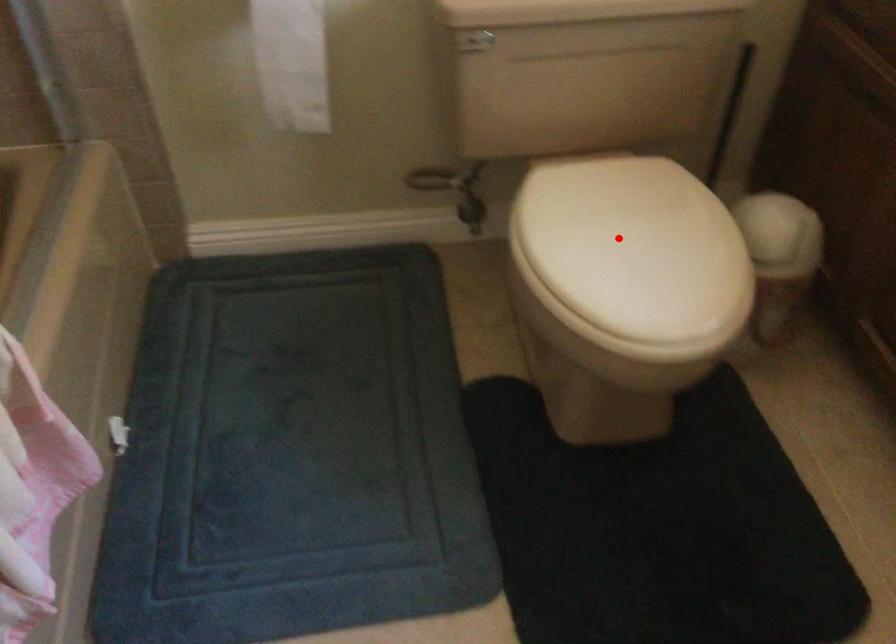
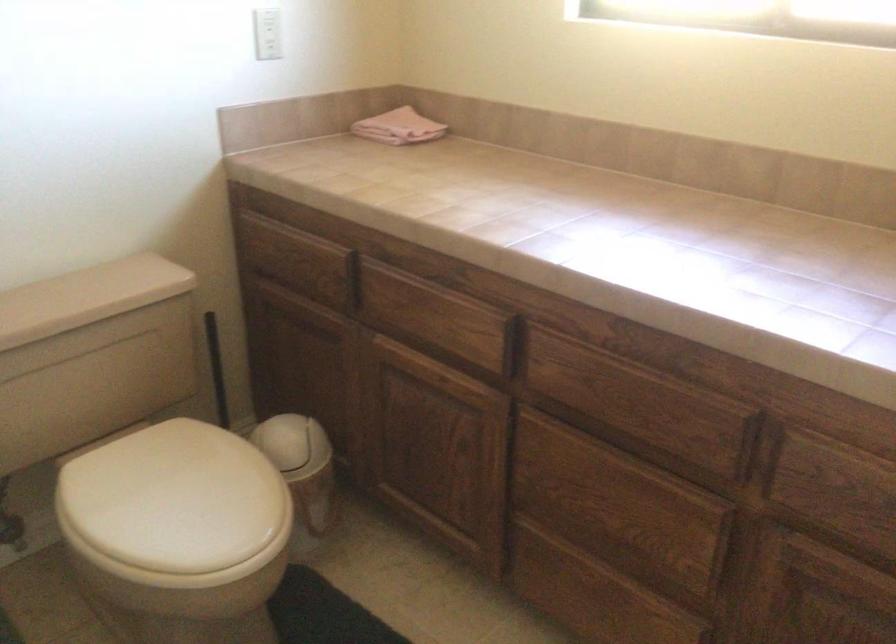
Question: A red point is marked in image1. In image2, is the corresponding 3D point closer to the camera or farther? Reply with the corresponding letter.

Choices:
 (A) The corresponding 3D point is closer.
 (B) The corresponding 3D point is farther.

Answer: (B)